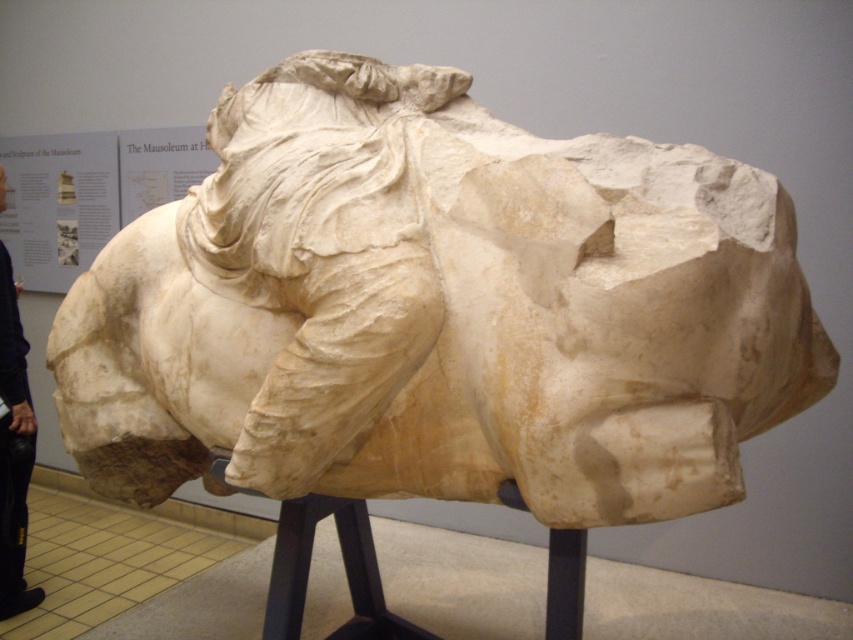
Does white marble horse at center have a smaller size compared to black leather pants at lower left?

Actually, white marble horse at center might be larger than black leather pants at lower left.

Can you confirm if white marble horse at center is positioned below black leather pants at lower left?

No, white marble horse at center is not below black leather pants at lower left.

The width and height of the screenshot is (853, 640). What do you see at coordinates (439, 310) in the screenshot?
I see `white marble horse at center` at bounding box center [439, 310].

At what (x,y) coordinates should I click in order to perform the action: click on white marble horse at center. Please return your answer as a coordinate pair (x, y). Looking at the image, I should click on (439, 310).